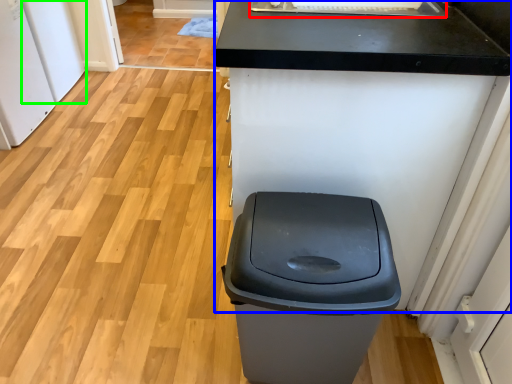
Question: Which object is positioned farthest from sink (highlighted by a red box)? Select from counter (highlighted by a blue box) and appliance (highlighted by a green box).

Choices:
 (A) counter
 (B) appliance

Answer: (B)